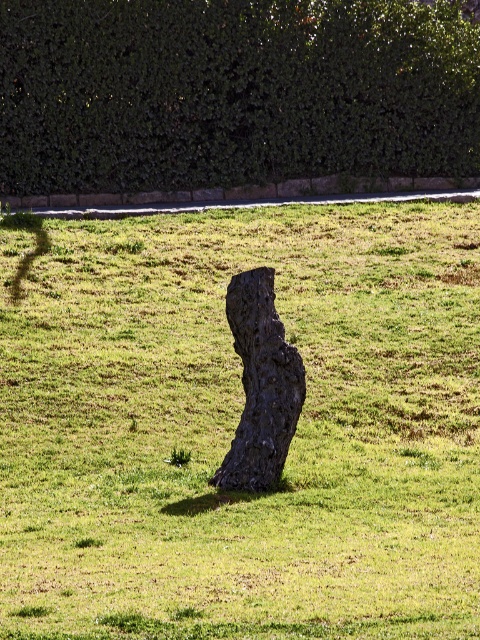
Does green leafy hedge at upper center appear under dark bark tree trunk at center?

Incorrect, green leafy hedge at upper center is not positioned below dark bark tree trunk at center.

Does green leafy hedge at upper center appear over dark bark tree trunk at center?

Yes, green leafy hedge at upper center is above dark bark tree trunk at center.

What do you see at coordinates (231, 92) in the screenshot?
I see `green leafy hedge at upper center` at bounding box center [231, 92].

Where is `green leafy hedge at upper center`? Image resolution: width=480 pixels, height=640 pixels. green leafy hedge at upper center is located at coordinates (231, 92).

In the scene shown: Which is above, dark brown textured tree stump at center or green leafy hedge at upper center?

green leafy hedge at upper center

Who is more forward, (83, 634) or (348, 140)?

Positioned in front is point (83, 634).

Identify the location of dark brown textured tree stump at center. (236, 426).

I want to click on dark brown textured tree stump at center, so click(236, 426).

Can you confirm if dark brown textured tree stump at center is shorter than dark bark tree trunk at center?

Incorrect, dark brown textured tree stump at center's height does not fall short of dark bark tree trunk at center's.

Who is higher up, dark brown textured tree stump at center or dark bark tree trunk at center?

dark brown textured tree stump at center

Is point (422, 312) positioned behind point (245, 413)?

Yes, it is behind point (245, 413).

Find the location of a particular element. dark brown textured tree stump at center is located at coordinates (236, 426).